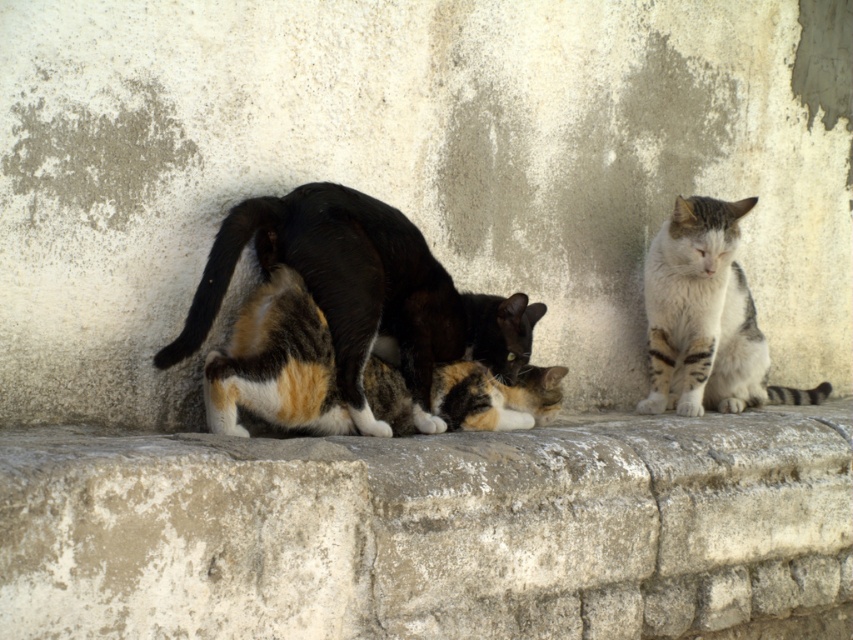
You are a bird flying above the gray stone wall at center and the striped fur cat at right. Which object is taller from your perspective?

The striped fur cat at right is taller than the gray stone wall at center.

You are standing in front of the stone ledge where the cats are resting. You notice two points marked on the ledge. Which point is closer to you, point (285, 236) or point (666, 358)?

Point (285, 236) is closer to the viewer than point (666, 358).

You are a photographer aiming to capture the calico fur cat at center and the gray stone wall at center in a single shot. Based on their positions, can you determine which object is closer to the camera?

The gray stone wall at center is located below the calico fur cat at center, meaning the gray stone wall at center is closer to the camera than the calico fur cat at center.